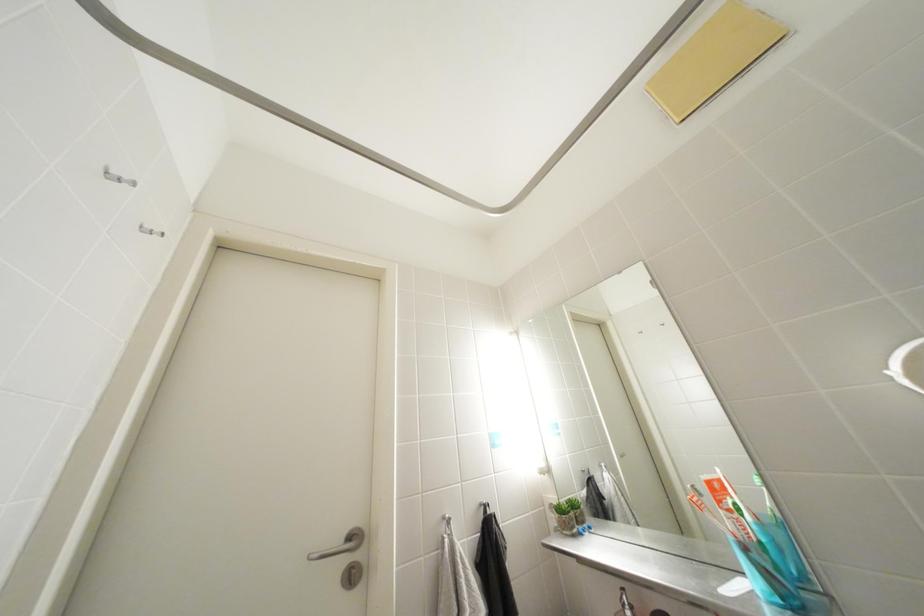
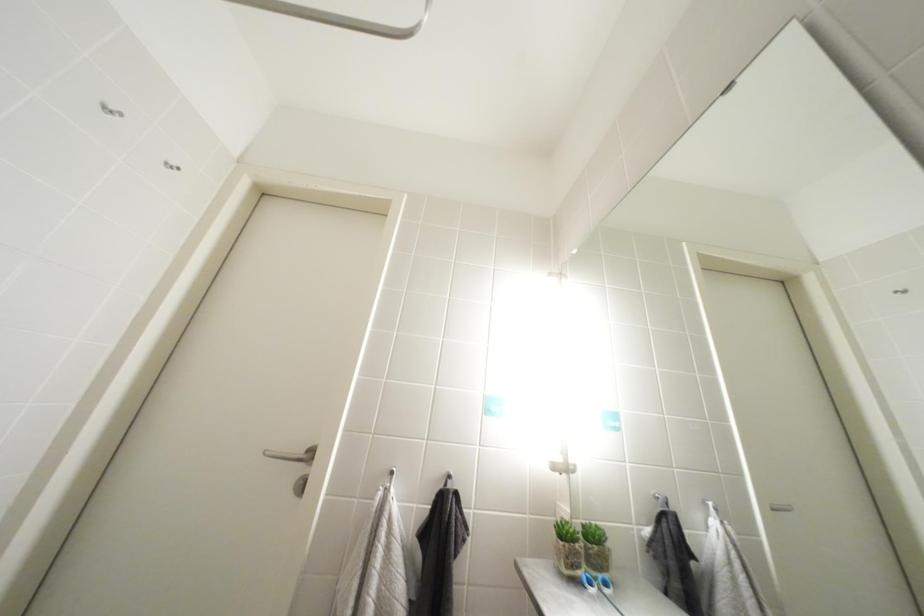
Based on the photo, what movement of the cameraman would produce the second image?

The cameraman walked toward right, forward.